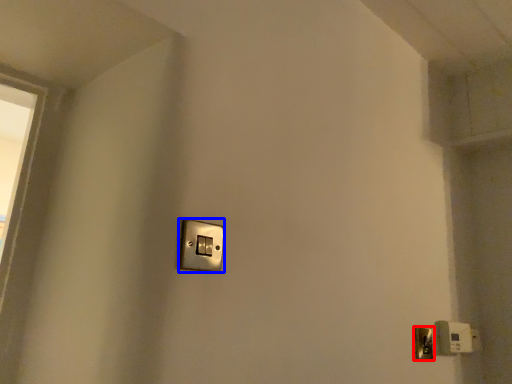
Question: Which of the following is the farthest to the observer, door handle (highlighted by a red box) or light switch (highlighted by a blue box)?

Choices:
 (A) door handle
 (B) light switch

Answer: (A)